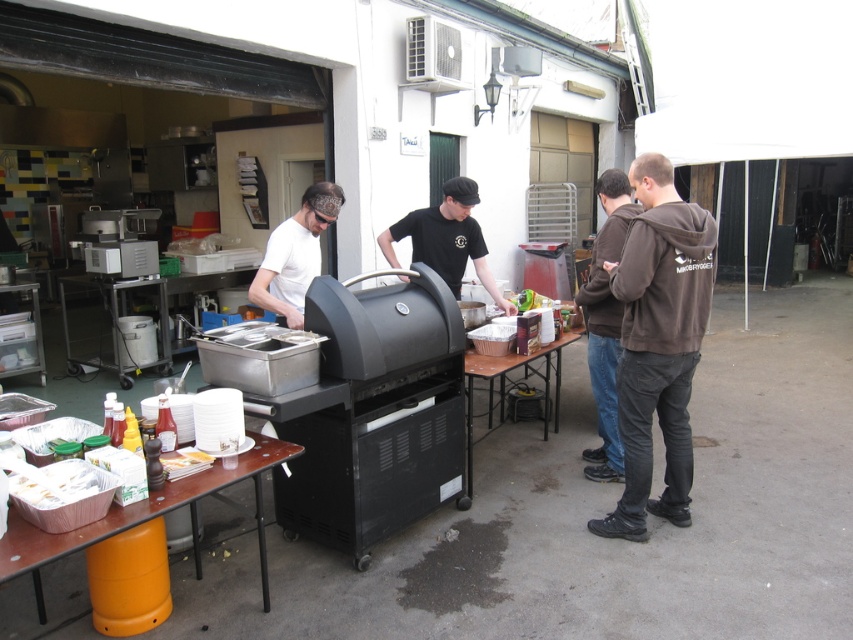
Is brown cotton hoodie at center further to the viewer compared to wooden table at center?

That is False.

Does brown cotton hoodie at center have a greater width compared to wooden table at center?

No, brown cotton hoodie at center is not wider than wooden table at center.

This screenshot has height=640, width=853. What do you see at coordinates (659, 342) in the screenshot? I see `brown cotton hoodie at center` at bounding box center [659, 342].

You are a GUI agent. You are given a task and a screenshot of the screen. Output one action in this format:
    pyautogui.click(x=<x>, y=<y>)
    Task: Click on the brown cotton hoodie at center
    This screenshot has width=853, height=640.
    Given the screenshot: What is the action you would take?
    pyautogui.click(x=659, y=342)

In order to click on brown hoodie at right in this screenshot , I will do (x=605, y=324).

Does brown hoodie at right appear under black matte grill at center?

Yes.

Where is `brown hoodie at right`? The height and width of the screenshot is (640, 853). brown hoodie at right is located at coordinates (605, 324).

Does black matte barbecue grill at center have a greater width compared to black matte grill at center?

Yes.

Can you confirm if black matte barbecue grill at center is smaller than black matte grill at center?

Actually, black matte barbecue grill at center might be larger than black matte grill at center.

Which is in front, point (354, 518) or point (451, 209)?

Point (354, 518)

Find the location of a particular element. black matte barbecue grill at center is located at coordinates click(x=373, y=413).